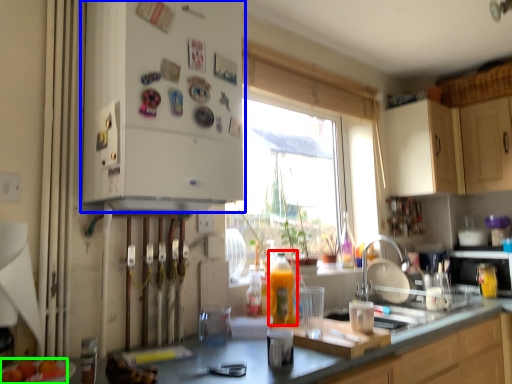
Question: Which object is positioned closest to bottle (highlighted by a red box)? Select from cabinetry (highlighted by a blue box) and food (highlighted by a green box).

Choices:
 (A) cabinetry
 (B) food

Answer: (A)